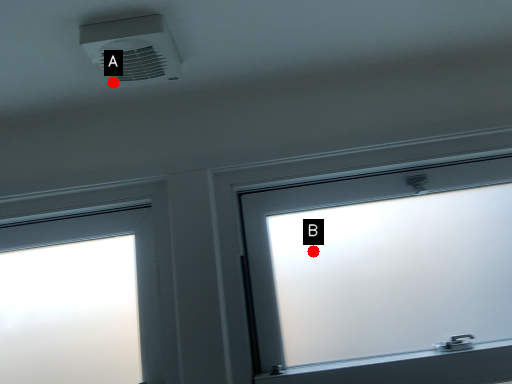
Question: Two points are circled on the image, labeled by A and B beside each circle. Which point is further to the camera?

Choices:
 (A) A is further
 (B) B is further

Answer: (B)